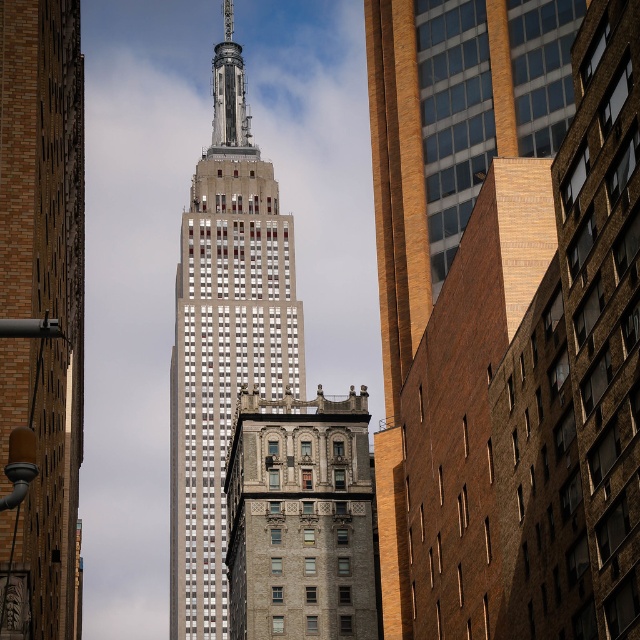
Question: Among these objects, which one is nearest to the camera?

Choices:
 (A) white glass skyscraper at center
 (B) white marble tower at center

Answer: (A)

Question: Is white glass skyscraper at center below white marble tower at center?

Choices:
 (A) yes
 (B) no

Answer: (B)

Question: Is the position of white glass skyscraper at center less distant than that of white marble tower at center?

Choices:
 (A) yes
 (B) no

Answer: (A)

Question: Which point appears farthest from the camera in this image?

Choices:
 (A) (74, 244)
 (B) (314, 413)
 (C) (284, 348)

Answer: (C)

Question: Does white marble tower at center have a lesser width compared to gray stone building at center?

Choices:
 (A) yes
 (B) no

Answer: (B)

Question: Among these points, which one is nearest to the camera?

Choices:
 (A) (364, 532)
 (B) (237, 378)
 (C) (35, 38)

Answer: (C)